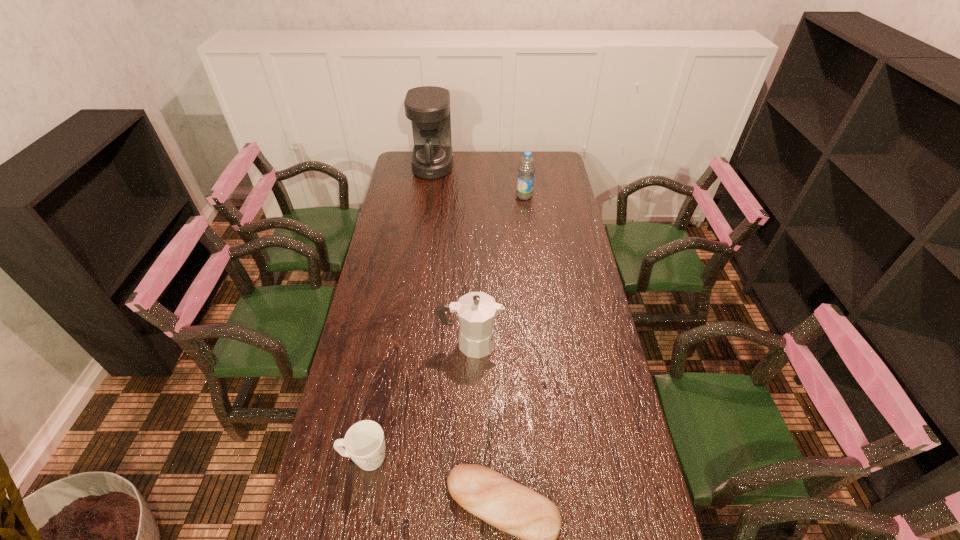
This screenshot has height=540, width=960. Find the location of `coffee maker situated at the left edge`. coffee maker situated at the left edge is located at coordinates (428, 107).

Image resolution: width=960 pixels, height=540 pixels. Identify the location of mug located at the left edge. (364, 442).

Find the location of a particular element. The image size is (960, 540). object at the far left corner is located at coordinates (428, 107).

Locate an element on the screen. vacant space at the far edge of the desktop is located at coordinates (483, 167).

Where is `blank area at the left edge`? Image resolution: width=960 pixels, height=540 pixels. blank area at the left edge is located at coordinates (347, 360).

Identify the location of vacant region at the right edge of the desktop. Image resolution: width=960 pixels, height=540 pixels. (564, 177).

Find the location of a particular element. Image resolution: width=960 pixels, height=540 pixels. free space between the fourth tallest object and the coffeepot is located at coordinates (418, 401).

The height and width of the screenshot is (540, 960). Identify the location of vacant area that lies between the coffee maker and the mug. (399, 312).

Image resolution: width=960 pixels, height=540 pixels. What are the coordinates of `free space between the coffee maker and the second shortest object` in the screenshot? It's located at (399, 312).

The height and width of the screenshot is (540, 960). In order to click on vacant area that lies between the third nearest object and the coffee maker in this screenshot , I will do pyautogui.click(x=452, y=254).